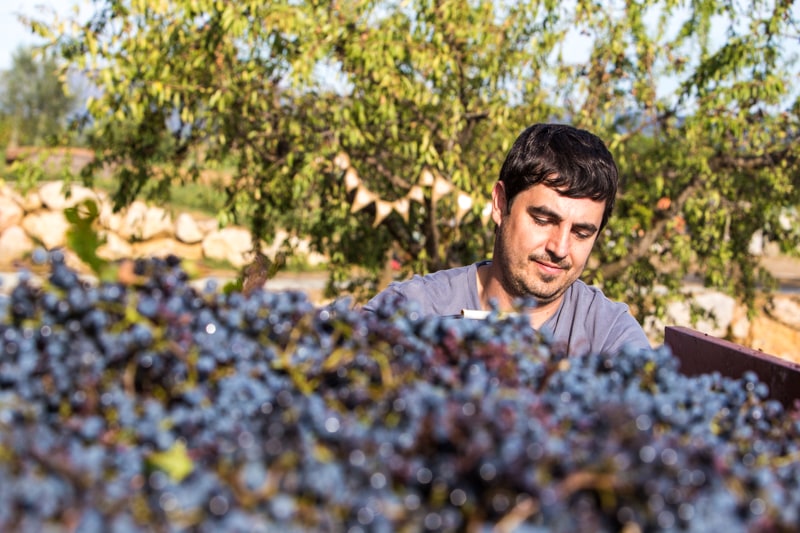
In order to click on small thin dark brown or red wall in this screenshot , I will do `click(726, 356)`.